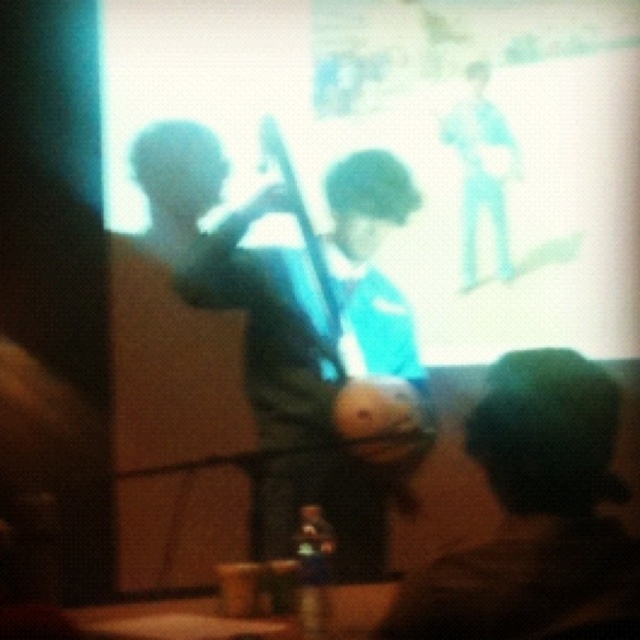
Does blue fabric shirt at center come behind green fuzzy hat at lower right?

Yes, blue fabric shirt at center is behind green fuzzy hat at lower right.

Does blue fabric shirt at center have a larger size compared to green fuzzy hat at lower right?

Yes.

Is point (384, 390) behind point (520, 392)?

Yes, point (384, 390) is farther from viewer.

Identify the location of blue fabric shirt at center. This screenshot has width=640, height=640. (291, 353).

In the scene shown: Which is above, white glossy projection screen at upper center or blue fabric shirt at center?

white glossy projection screen at upper center

The width and height of the screenshot is (640, 640). Describe the element at coordinates (420, 145) in the screenshot. I see `white glossy projection screen at upper center` at that location.

Which is behind, point (620, 145) or point (321, 256)?

The point (620, 145) is behind.

You are a GUI agent. You are given a task and a screenshot of the screen. Output one action in this format:
    pyautogui.click(x=<x>, y=<y>)
    Task: Click on the white glossy projection screen at upper center
    The image size is (640, 640).
    Given the screenshot: What is the action you would take?
    point(420,145)

Who is taller, white glossy projection screen at upper center or green fuzzy hat at lower right?

Standing taller between the two is white glossy projection screen at upper center.

Between point (355, 278) and point (570, 481), which one is positioned in front?

Point (570, 481)

Describe the element at coordinates (420, 145) in the screenshot. Image resolution: width=640 pixels, height=640 pixels. I see `white glossy projection screen at upper center` at that location.

The width and height of the screenshot is (640, 640). Identify the location of white glossy projection screen at upper center. (420, 145).